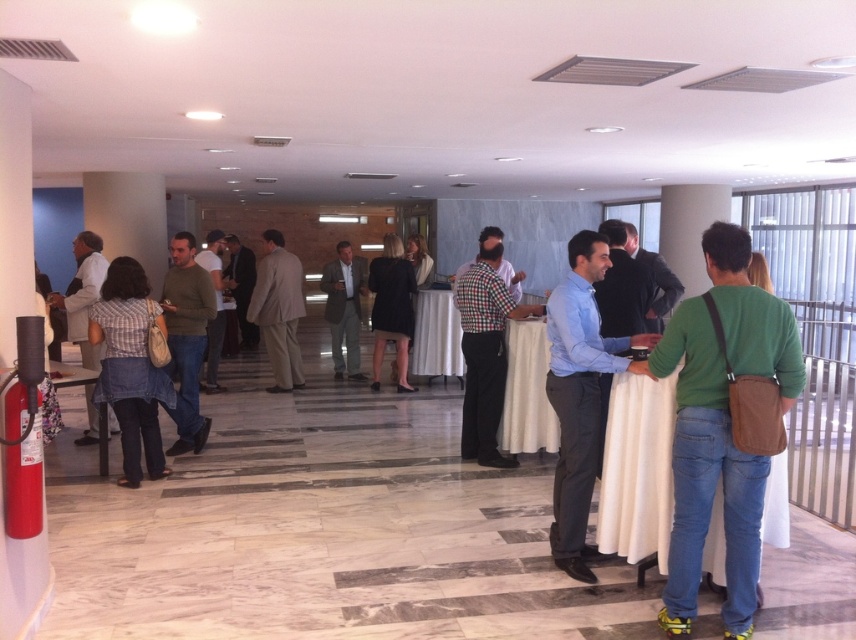
Question: Can you confirm if black fabric dress at center is wider than light brown leather jacket at center?

Choices:
 (A) no
 (B) yes

Answer: (A)

Question: Which point appears farthest from the camera in this image?

Choices:
 (A) (70, 292)
 (B) (551, 545)
 (C) (488, 394)

Answer: (A)

Question: Can you confirm if matte gray blazer at left is smaller than light gray suit at center?

Choices:
 (A) no
 (B) yes

Answer: (A)

Question: Which point is closer to the camera taking this photo?

Choices:
 (A) (296, 291)
 (B) (125, 355)
 (C) (479, 262)
 (D) (597, 397)

Answer: (D)

Question: Is checkered fabric shirt at center positioned in front of light beige suit at center?

Choices:
 (A) yes
 (B) no

Answer: (A)

Question: Which is farther from the light blue shirt at center?

Choices:
 (A) light beige suit at center
 (B) green sweater at center

Answer: (A)